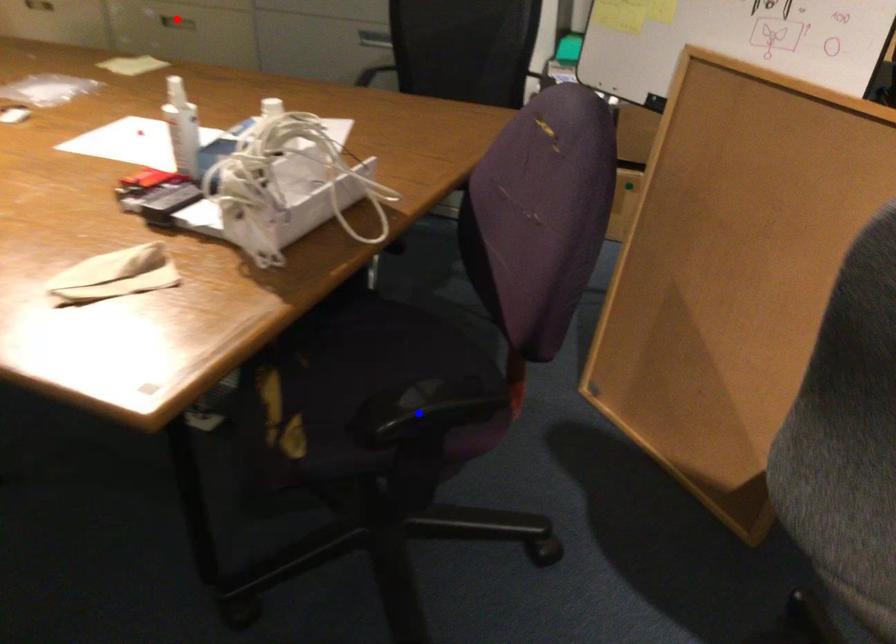
Question: Two points are marked on the image. Which point is closer to the camera?

Choices:
 (A) Blue point is closer.
 (B) Red point is closer.

Answer: (A)